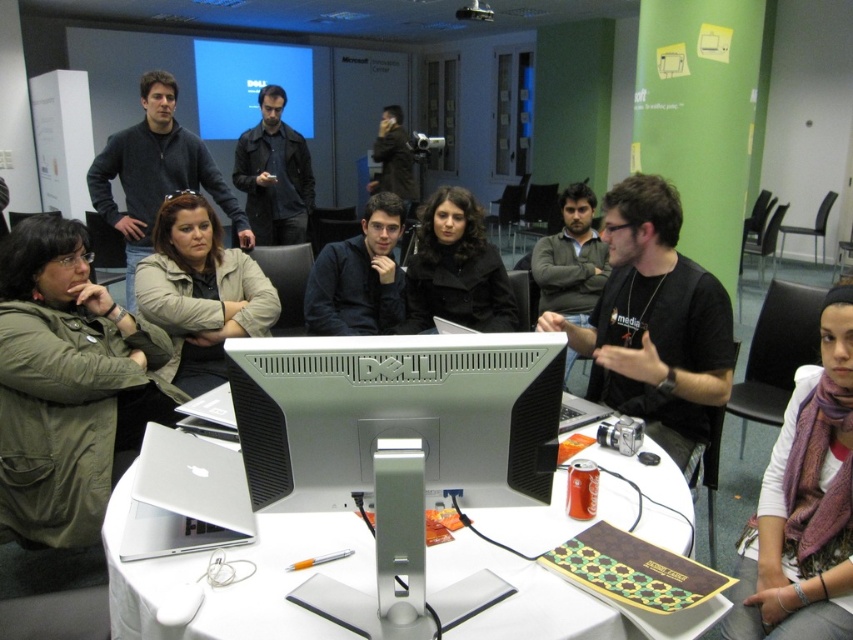
Question: Can you confirm if green matte jacket at upper left is wider than dark brown hair at center?

Choices:
 (A) no
 (B) yes

Answer: (B)

Question: Which point is closer to the camera?

Choices:
 (A) purple scarf at lower right
 (B) dark brown leather jacket at center
 (C) matte khaki jacket at center

Answer: (A)

Question: Which object is the closest to the black matte shirt at center?

Choices:
 (A) dark blue sweater at center
 (B) matte khaki jacket at center

Answer: (A)

Question: Observing the image, what is the correct spatial positioning of white glossy table at center in reference to silver metallic laptop at lower left?

Choices:
 (A) below
 (B) above

Answer: (A)

Question: Can you confirm if purple scarf at lower right is positioned to the right of matte khaki jacket at center?

Choices:
 (A) yes
 (B) no

Answer: (A)

Question: Which of these objects is positioned farthest from the black matte shirt at center?

Choices:
 (A) silver metallic monitor at center
 (B) purple scarf at lower right

Answer: (A)